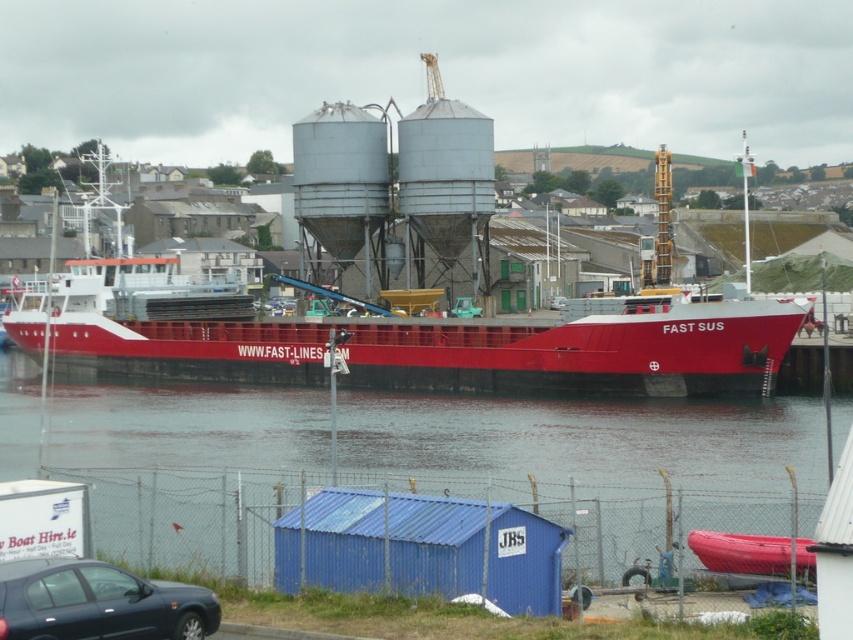
Question: Is smooth water at center wider than matte red ship at center?

Choices:
 (A) yes
 (B) no

Answer: (A)

Question: Does smooth water at center come in front of matte red ship at center?

Choices:
 (A) yes
 (B) no

Answer: (A)

Question: Can you confirm if matte red ship at center is positioned to the left of rubberized red kayak at lower right?

Choices:
 (A) yes
 (B) no

Answer: (A)

Question: Which point is farther to the camera?

Choices:
 (A) click(762, 540)
 (B) click(97, 579)
 (C) click(473, 369)
 (D) click(259, 460)

Answer: (C)

Question: Which object appears closest to the camera in this image?

Choices:
 (A) smooth water at center
 (B) matte black car at lower left
 (C) rubberized red kayak at lower right

Answer: (B)

Question: Which point appears farthest from the camera in this image?

Choices:
 (A) pyautogui.click(x=167, y=609)
 (B) pyautogui.click(x=564, y=445)

Answer: (B)